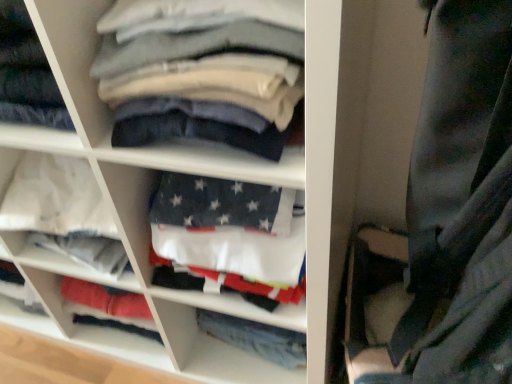
Question: From a real-world perspective, is denim pants at center physically above white cotton shirts at center?

Choices:
 (A) yes
 (B) no

Answer: (B)

Question: Can you confirm if denim pants at center is smaller than white cotton shirts at center?

Choices:
 (A) no
 (B) yes

Answer: (B)

Question: Could you tell me if denim pants at center is turned towards white cotton shirts at center?

Choices:
 (A) yes
 (B) no

Answer: (A)

Question: Is denim pants at center closer to camera compared to white cotton shirts at center?

Choices:
 (A) no
 (B) yes

Answer: (A)

Question: Is denim pants at center taller than white cotton shirts at center?

Choices:
 (A) yes
 (B) no

Answer: (B)

Question: From a real-world perspective, is smooth cotton shirts at center physically located above or below white fabric at center?

Choices:
 (A) above
 (B) below

Answer: (A)

Question: In the image, is smooth cotton shirts at center on the left side or the right side of white fabric at center?

Choices:
 (A) right
 (B) left

Answer: (A)

Question: Is point (162, 52) closer or farther from the camera than point (115, 264)?

Choices:
 (A) closer
 (B) farther

Answer: (A)

Question: Looking at their shapes, would you say smooth cotton shirts at center is wider or thinner than white fabric at center?

Choices:
 (A) thin
 (B) wide

Answer: (A)

Question: Is smooth cotton shirts at center taller or shorter than denim pants at center?

Choices:
 (A) short
 (B) tall

Answer: (B)

Question: From the image's perspective, is smooth cotton shirts at center above or below denim pants at center?

Choices:
 (A) above
 (B) below

Answer: (A)

Question: Considering the positions of smooth cotton shirts at center and denim pants at center in the image, is smooth cotton shirts at center wider or thinner than denim pants at center?

Choices:
 (A) wide
 (B) thin

Answer: (A)

Question: In terms of size, does smooth cotton shirts at center appear bigger or smaller than denim pants at center?

Choices:
 (A) big
 (B) small

Answer: (A)

Question: From the image's perspective, is white fabric at center above or below denim pants at center?

Choices:
 (A) below
 (B) above

Answer: (B)

Question: Considering their positions, is white fabric at center located in front of or behind denim pants at center?

Choices:
 (A) front
 (B) behind

Answer: (A)